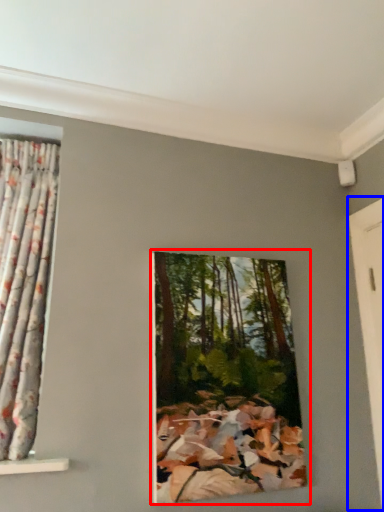
Question: Which point is further to the camera, oil painting (highlighted by a red box) or door (highlighted by a blue box)?

Choices:
 (A) oil painting
 (B) door

Answer: (B)